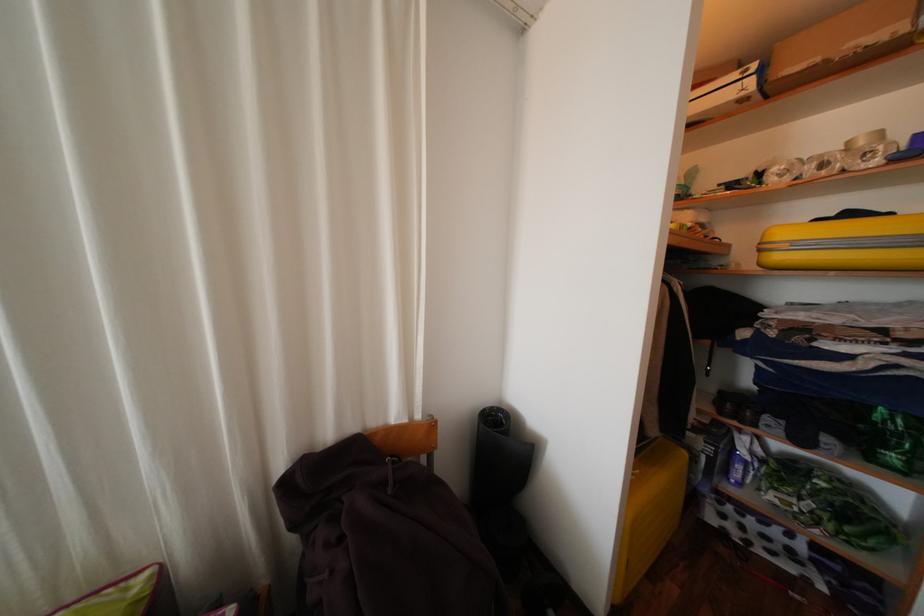
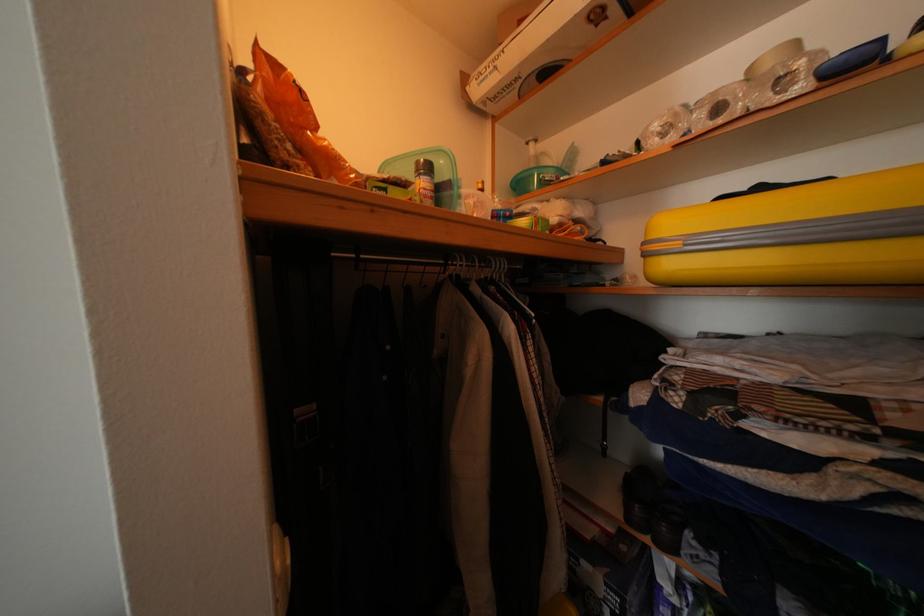
From the picture: What movement of the cameraman would produce the second image?

The movement direction of the cameraman is right, forward.